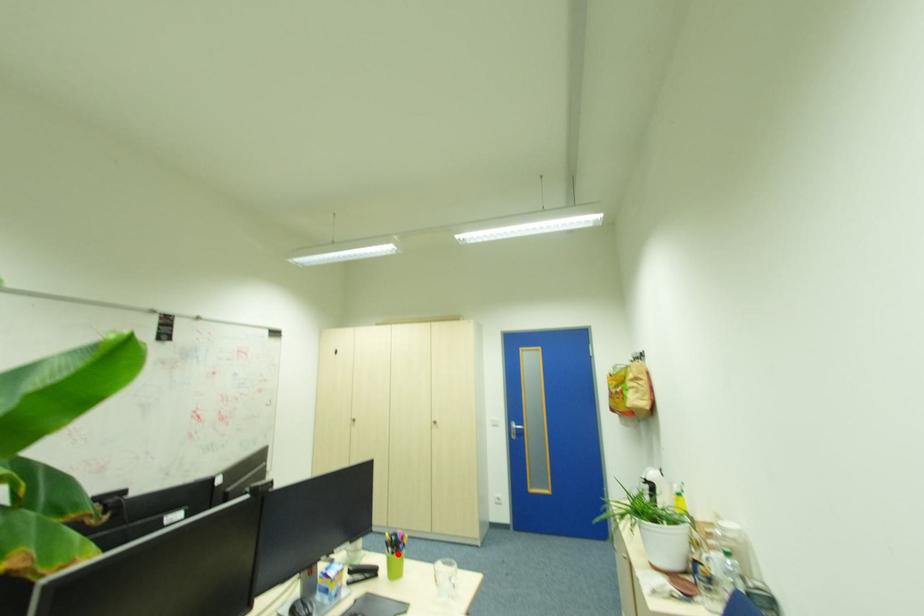
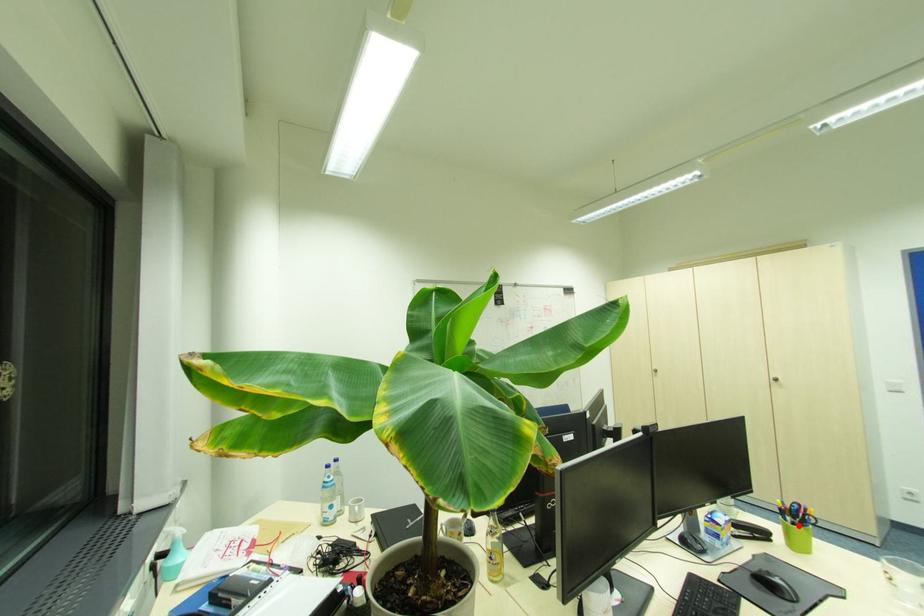
I am providing you with two images of the same scene from different viewpoints. A red point is marked on the first image and another point is marked on the second image. Does the point marked in image1 correspond to the same location as the one in image2?

Yes